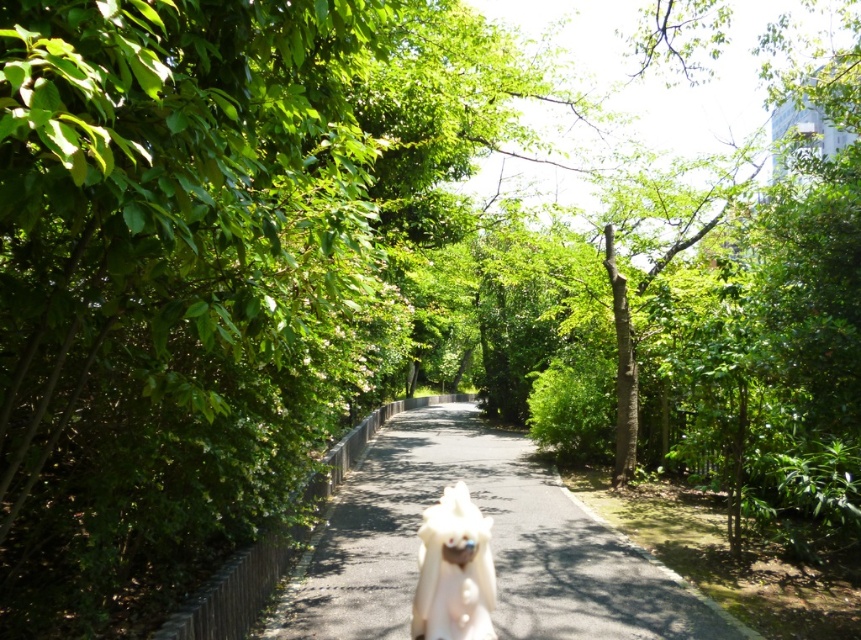
Question: Which of the following is the closest to the observer?

Choices:
 (A) (506, 520)
 (B) (419, 611)

Answer: (B)

Question: Is white fabric dog at center wider than white fur dog at center?

Choices:
 (A) yes
 (B) no

Answer: (A)

Question: Does white fabric dog at center appear on the right side of white fur dog at center?

Choices:
 (A) no
 (B) yes

Answer: (B)

Question: Does white fabric dog at center appear over white fur dog at center?

Choices:
 (A) yes
 (B) no

Answer: (B)